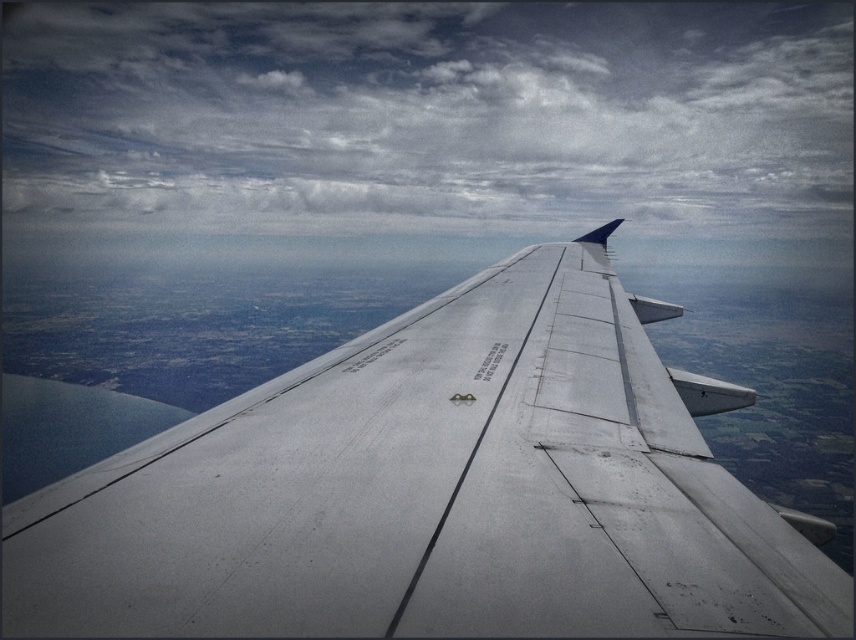
Does metallic gray wing at center appear under cloudy sky at upper center?

Yes.

Measure the distance between point (200, 592) and camera.

Point (200, 592) and camera are 30.30 inches apart from each other.

Is point (317, 365) closer to camera compared to point (389, 26)?

Yes.

Identify the location of metallic gray wing at center. The image size is (856, 640). [437, 492].